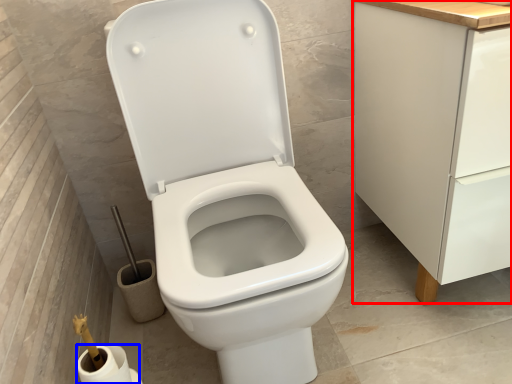
Question: Which object appears closest to the camera in this image, cabinetry (highlighted by a red box) or toilet paper (highlighted by a blue box)?

Choices:
 (A) cabinetry
 (B) toilet paper

Answer: (A)